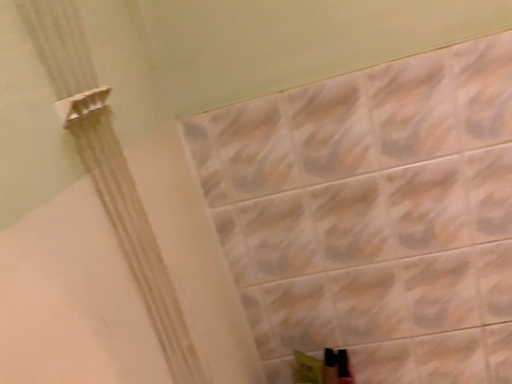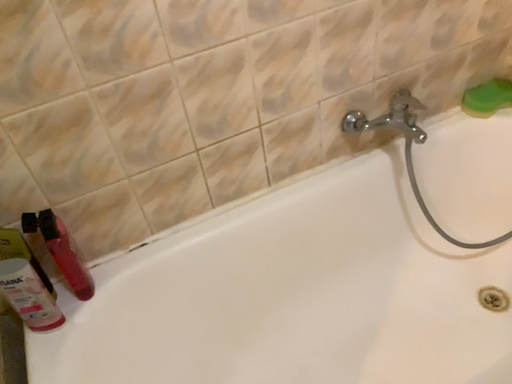
Question: How did the camera likely rotate when shooting the video?

Choices:
 (A) rotated left
 (B) rotated right

Answer: (B)